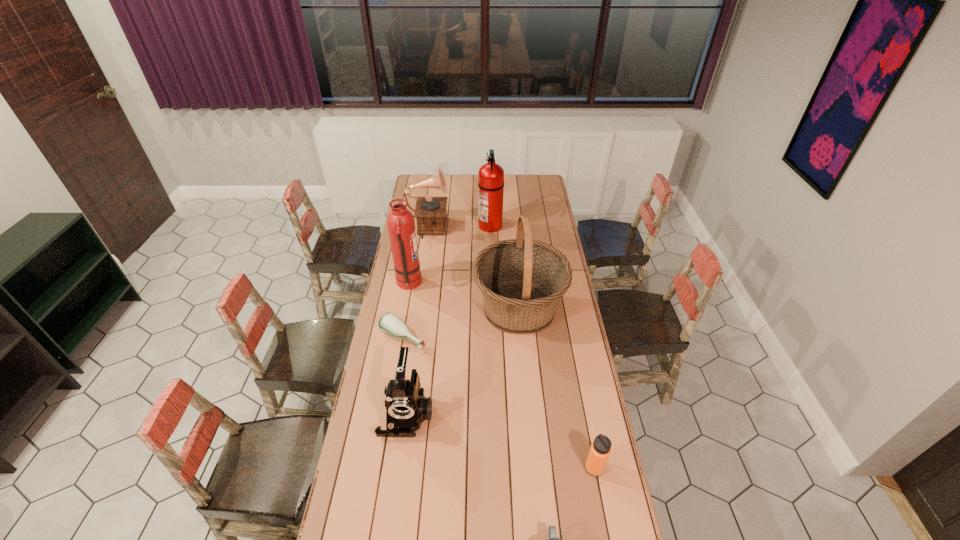
Locate an element on the screen. free space that satisfies the following two spatial constraints: 1. on the horn of the basket; 2. on the left side of the record player is located at coordinates (415, 308).

Where is `free region that satisfies the following two spatial constraints: 1. on the lens mount of the fourth shortest object; 2. on the left side of the thermos bottle`? The width and height of the screenshot is (960, 540). free region that satisfies the following two spatial constraints: 1. on the lens mount of the fourth shortest object; 2. on the left side of the thermos bottle is located at coordinates (399, 468).

The height and width of the screenshot is (540, 960). I want to click on free space that satisfies the following two spatial constraints: 1. on the horn of the basket; 2. on the right side of the record player, so click(x=415, y=308).

This screenshot has height=540, width=960. Find the location of `vacant area in the image that satisfies the following two spatial constraints: 1. at the nozzle of the basket; 2. on the right side of the right fire extinguisher`. vacant area in the image that satisfies the following two spatial constraints: 1. at the nozzle of the basket; 2. on the right side of the right fire extinguisher is located at coordinates (492, 308).

You are a GUI agent. You are given a task and a screenshot of the screen. Output one action in this format:
    pyautogui.click(x=<x>, y=<y>)
    Task: Click on the free space that satisfies the following two spatial constraints: 1. on the back side of the sixth tallest object; 2. on the horn of the record player
    This screenshot has width=960, height=540.
    Given the screenshot: What is the action you would take?
    pyautogui.click(x=548, y=231)